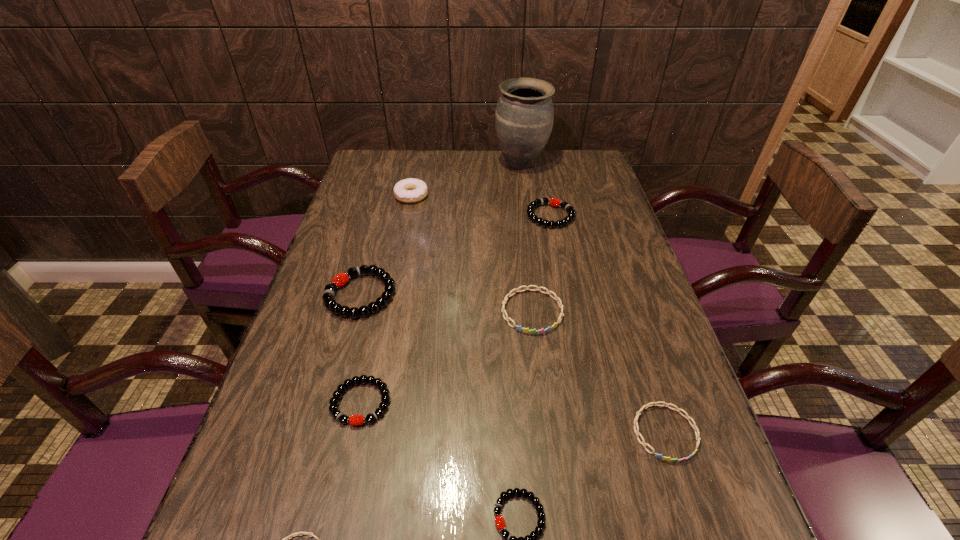
What are the coordinates of `the second nearest black bracelet` in the screenshot? It's located at (382, 386).

Locate an element on the screen. The image size is (960, 540). the second farthest blue bracelet is located at coordinates (646, 406).

You are a GUI agent. You are given a task and a screenshot of the screen. Output one action in this format:
    pyautogui.click(x=<x>, y=<y>)
    Task: Click on the second smallest blue bracelet
    
    Given the screenshot: What is the action you would take?
    pyautogui.click(x=646, y=406)

In order to click on free location located 0.260m on the left of the urn in this screenshot , I will do `click(422, 164)`.

In order to click on blank space located on the right of the second tallest object in this screenshot , I will do `click(502, 196)`.

Locate an element on the screen. This screenshot has width=960, height=540. free space located on the back of the third nearest black bracelet is located at coordinates tap(379, 228).

Identify the location of vacant space situated on the front of the rightmost black bracelet. (565, 286).

Locate an element on the screen. vacant area situated on the surface of the biggest blue bracelet showing star-shaped elements is located at coordinates (554, 500).

I want to click on free space located on the right of the second smallest black bracelet, so click(461, 402).

Where is `blank space located on the surface of the rightmost blue bracelet showing star-shaped elements`? blank space located on the surface of the rightmost blue bracelet showing star-shaped elements is located at coordinates (686, 498).